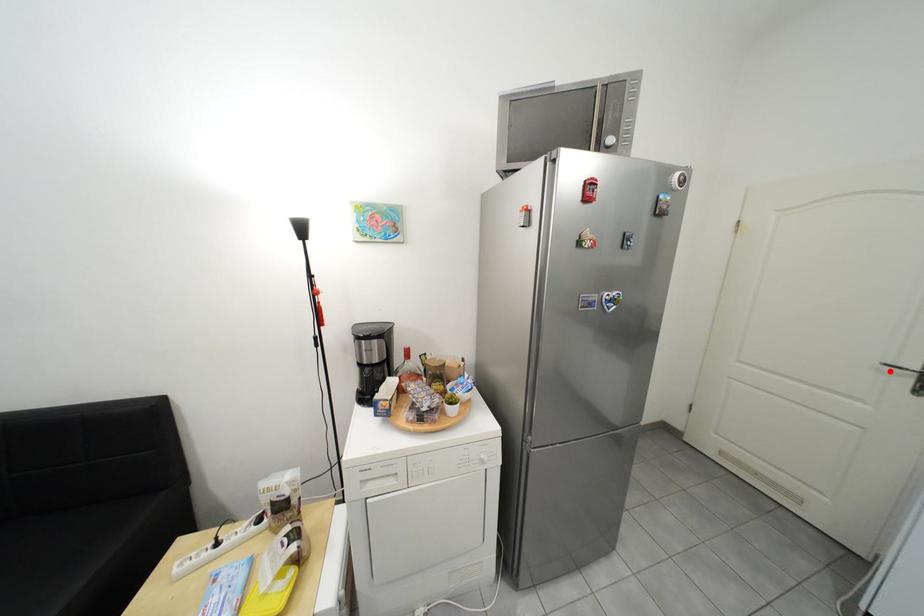
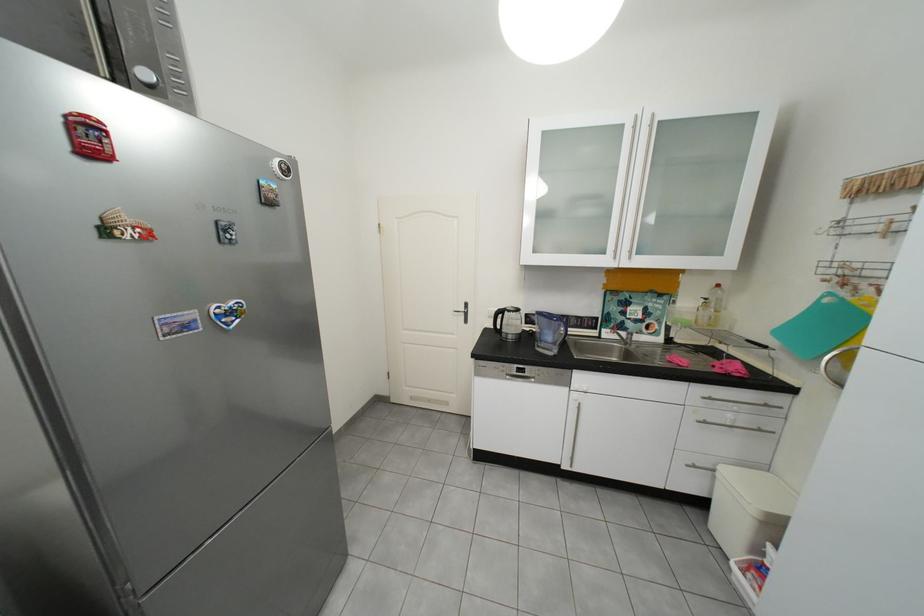
Where in the second image is the point corresponding to the highlighted location from the first image?

(466, 315)